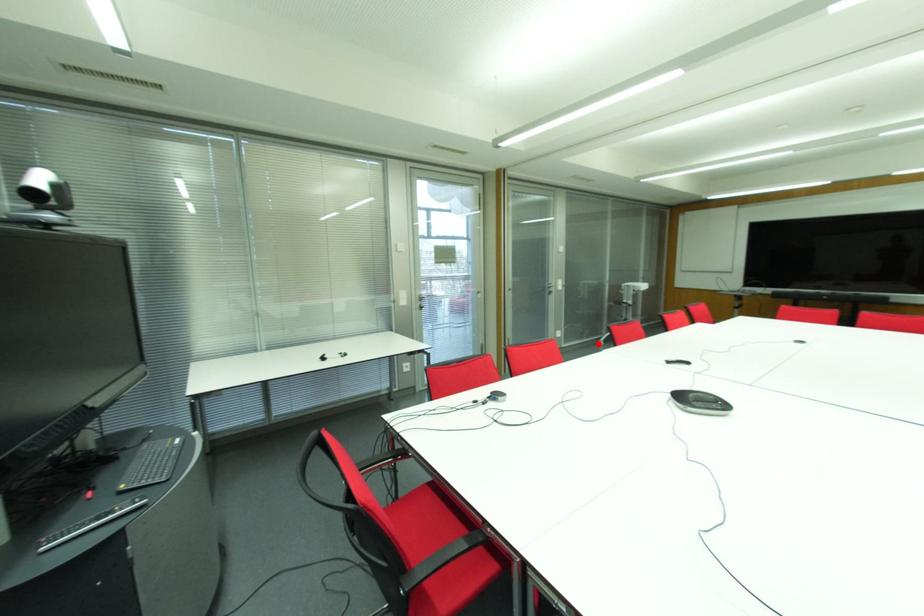
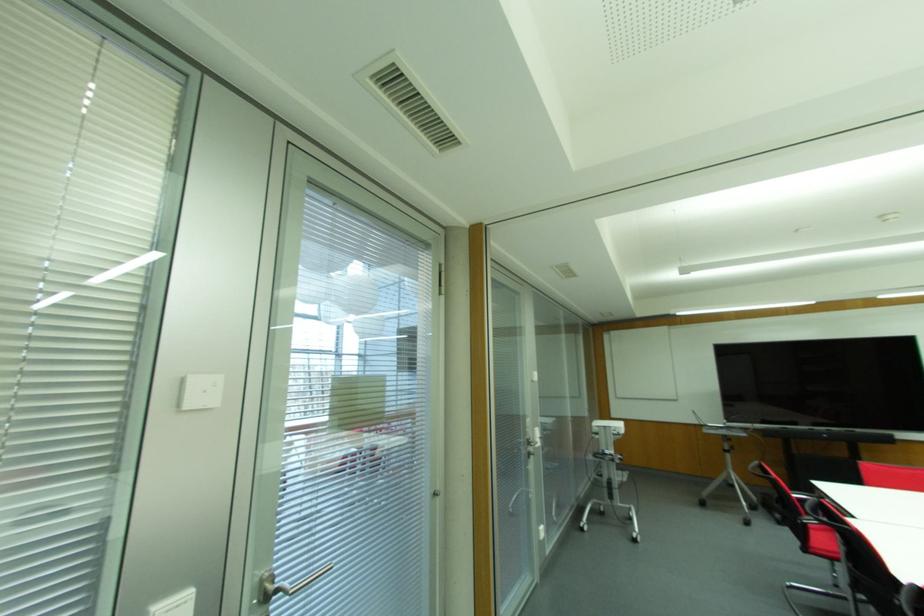
Locate, in the second image, the point that corresponds to the highlighted location in the first image.

(581, 529)